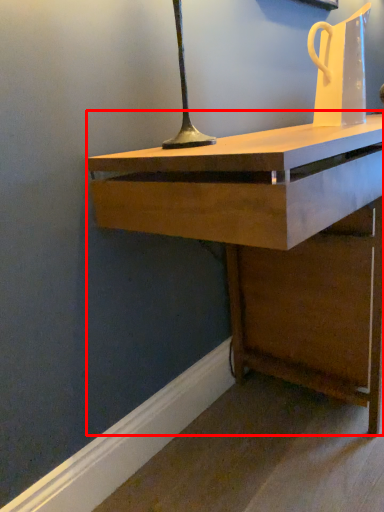
Question: From the image's perspective, where is desk (annotated by the red box) located relative to jug?

Choices:
 (A) below
 (B) above

Answer: (A)